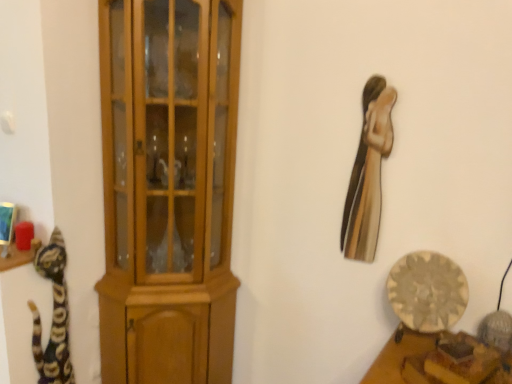
Image resolution: width=512 pixels, height=384 pixels. I want to click on light brown wood cupboard at left, so click(168, 189).

This screenshot has height=384, width=512. I want to click on metallic gold statue at upper right, so click(x=366, y=184).

Where is `wooden plate at lower right`? The width and height of the screenshot is (512, 384). wooden plate at lower right is located at coordinates (437, 360).

Describe the element at coordinates (53, 316) in the screenshot. The width and height of the screenshot is (512, 384). I see `multicolored fur cat at left` at that location.

This screenshot has width=512, height=384. Identify the location of light brown wood cupboard at left. (168, 189).

How different are the orientations of metallic gold statue at upper right and light brown wood cupboard at left in degrees?

metallic gold statue at upper right and light brown wood cupboard at left are facing 91.4 degrees away from each other.

Who is smaller, metallic gold statue at upper right or light brown wood cupboard at left?

metallic gold statue at upper right is smaller.

Which of these two, metallic gold statue at upper right or light brown wood cupboard at left, is thinner?

metallic gold statue at upper right.

Is metallic gold statue at upper right not close to light brown wood cupboard at left?

No, there isn't a large distance between metallic gold statue at upper right and light brown wood cupboard at left.

Between metallic gold statue at upper right and multicolored fur cat at left, which one has larger width?

multicolored fur cat at left is wider.

Does metallic gold statue at upper right lie in front of multicolored fur cat at left?

Yes, the depth of metallic gold statue at upper right is less than that of multicolored fur cat at left.

Based on their sizes in the image, would you say metallic gold statue at upper right is bigger or smaller than multicolored fur cat at left?

Clearly, metallic gold statue at upper right is smaller in size than multicolored fur cat at left.

Looking at this image, from a real-world perspective, who is located lower, metallic gold statue at upper right or multicolored fur cat at left?

From a 3D spatial view, multicolored fur cat at left is below.

Where is `furniture that is in front of the metallic gold statue at upper right`? Image resolution: width=512 pixels, height=384 pixels. furniture that is in front of the metallic gold statue at upper right is located at coordinates (437, 360).

Between wooden plate at lower right and metallic gold statue at upper right, which one appears on the right side from the viewer's perspective?

From the viewer's perspective, wooden plate at lower right appears more on the right side.

Which is correct: wooden plate at lower right is inside metallic gold statue at upper right, or outside of it?

wooden plate at lower right cannot be found inside metallic gold statue at upper right.

What's the angular difference between wooden plate at lower right and metallic gold statue at upper right's facing directions?

38.1 degrees separate the facing orientations of wooden plate at lower right and metallic gold statue at upper right.

Is multicolored fur cat at left to the right of light brown wood cupboard at left from the viewer's perspective?

Incorrect, multicolored fur cat at left is not on the right side of light brown wood cupboard at left.

Which object is wider, multicolored fur cat at left or light brown wood cupboard at left?

light brown wood cupboard at left.

Can you confirm if multicolored fur cat at left is shorter than light brown wood cupboard at left?

Indeed, multicolored fur cat at left has a lesser height compared to light brown wood cupboard at left.

Is wooden plate at lower right turned away from light brown wood cupboard at left?

No, wooden plate at lower right is not facing away from light brown wood cupboard at left.

Which object is positioned more to the left, wooden plate at lower right or light brown wood cupboard at left?

From the viewer's perspective, light brown wood cupboard at left appears more on the left side.

Which object is further away from the camera, wooden plate at lower right or light brown wood cupboard at left?

Positioned behind is light brown wood cupboard at left.

Are wooden plate at lower right and light brown wood cupboard at left making contact?

No.

From a real-world perspective, is multicolored fur cat at left positioned under metallic gold statue at upper right based on gravity?

Yes, from a real-world perspective, multicolored fur cat at left is under metallic gold statue at upper right.

Are multicolored fur cat at left and metallic gold statue at upper right located far from each other?

multicolored fur cat at left is positioned a significant distance from metallic gold statue at upper right.

Considering the sizes of objects multicolored fur cat at left and metallic gold statue at upper right in the image provided, who is bigger, multicolored fur cat at left or metallic gold statue at upper right?

multicolored fur cat at left.

Does multicolored fur cat at left turn towards metallic gold statue at upper right?

No, multicolored fur cat at left does not turn towards metallic gold statue at upper right.

Is point (147, 220) less distant than point (53, 278)?

No, it is behind (53, 278).

Is there a large distance between light brown wood cupboard at left and multicolored fur cat at left?

No, light brown wood cupboard at left is in close proximity to multicolored fur cat at left.

What's the angular difference between light brown wood cupboard at left and multicolored fur cat at left's facing directions?

light brown wood cupboard at left and multicolored fur cat at left are facing 2.89 degrees away from each other.

Looking at the image, does light brown wood cupboard at left seem bigger or smaller compared to multicolored fur cat at left?

In the image, light brown wood cupboard at left appears to be larger than multicolored fur cat at left.

I want to click on animal above the light brown wood cupboard at left (from a real-world perspective), so (x=366, y=184).

The image size is (512, 384). I want to click on cat on the left side of metallic gold statue at upper right, so click(x=53, y=316).

Considering their positions, is metallic gold statue at upper right positioned further to wooden plate at lower right than light brown wood cupboard at left?

Based on the image, light brown wood cupboard at left appears to be further to wooden plate at lower right.

From the image, which object appears to be farther from wooden plate at lower right, light brown wood cupboard at left or metallic gold statue at upper right?

Among the two, light brown wood cupboard at left is located further to wooden plate at lower right.

Considering their positions, is wooden plate at lower right positioned further to light brown wood cupboard at left than multicolored fur cat at left?

wooden plate at lower right.

Looking at the image, which one is located further to wooden plate at lower right, multicolored fur cat at left or metallic gold statue at upper right?

Among the two, multicolored fur cat at left is located further to wooden plate at lower right.

When comparing their distances from multicolored fur cat at left, does wooden plate at lower right or metallic gold statue at upper right seem further?

Based on the image, wooden plate at lower right appears to be further to multicolored fur cat at left.

When comparing their distances from metallic gold statue at upper right, does multicolored fur cat at left or light brown wood cupboard at left seem closer?

Among the two, light brown wood cupboard at left is located nearer to metallic gold statue at upper right.

Which object lies further to the anchor point multicolored fur cat at left, light brown wood cupboard at left or wooden plate at lower right?

Among the two, wooden plate at lower right is located further to multicolored fur cat at left.

Estimate the real-world distances between objects in this image. Which object is further from metallic gold statue at upper right, light brown wood cupboard at left or multicolored fur cat at left?

The object further to metallic gold statue at upper right is multicolored fur cat at left.

Where is `animal situated between multicolored fur cat at left and wooden plate at lower right from left to right`? This screenshot has height=384, width=512. animal situated between multicolored fur cat at left and wooden plate at lower right from left to right is located at coordinates (366, 184).

Identify the location of cupboard located between multicolored fur cat at left and wooden plate at lower right in the left-right direction. Image resolution: width=512 pixels, height=384 pixels. (168, 189).

You are a GUI agent. You are given a task and a screenshot of the screen. Output one action in this format:
    pyautogui.click(x=<x>, y=<y>)
    Task: Click on the cupboard between multicolored fur cat at left and metallic gold statue at upper right in the horizontal direction
    This screenshot has width=512, height=384.
    Given the screenshot: What is the action you would take?
    pyautogui.click(x=168, y=189)

At what (x,y) coordinates should I click in order to perform the action: click on animal situated between light brown wood cupboard at left and wooden plate at lower right from left to right. Please return your answer as a coordinate pair (x, y). Image resolution: width=512 pixels, height=384 pixels. Looking at the image, I should click on (366, 184).